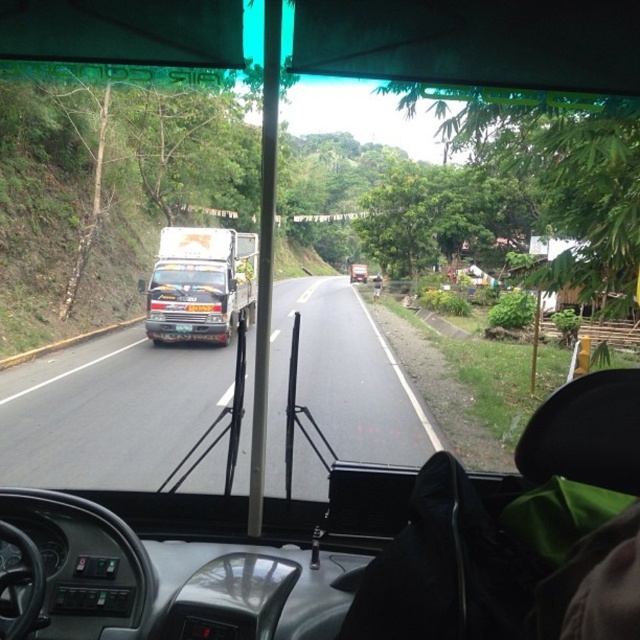
You are a passenger in the bus and looking out the window. You see a black matte truck at left and a metallic silver truck at center. Which truck is closer to the right side of the road?

The black matte truck at left is to the right of the metallic silver truck at center, so the black matte truck at left is closer to the right side of the road.

You are a delivery driver who needs to pass the black matte truck at left and the metallic silver truck at center on this two lane road. Which truck should you pass first?

The metallic silver truck at center should be passed first because it is narrower than the black matte truck at left, making it safer to overtake.

You are a passenger on a bus and notice two trucks outside the window. The black matte truck at left and the metallic silver truck at center. Which truck is bigger?

The black matte truck at left is larger in size than the metallic silver truck at center.